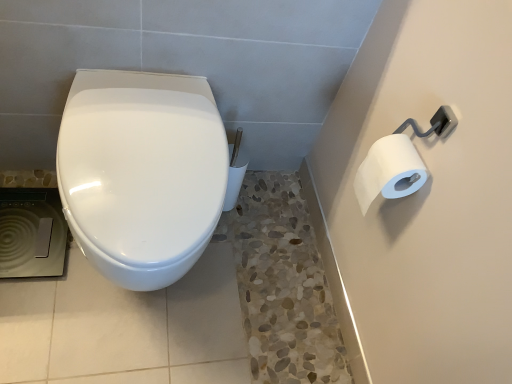
Question: Is white matte toilet paper at upper right to the left or to the right of glossy ceramic toilet at center in the image?

Choices:
 (A) left
 (B) right

Answer: (B)

Question: From the image's perspective, is white matte toilet paper at upper right above or below glossy ceramic toilet at center?

Choices:
 (A) below
 (B) above

Answer: (B)

Question: Relative to glossy ceramic toilet at center, is white matte toilet paper at upper right in front or behind?

Choices:
 (A) front
 (B) behind

Answer: (B)

Question: From the image's perspective, is glossy ceramic toilet at center positioned above or below white matte toilet paper at upper right?

Choices:
 (A) above
 (B) below

Answer: (B)

Question: Is glossy ceramic toilet at center in front of or behind white matte toilet paper at upper right in the image?

Choices:
 (A) front
 (B) behind

Answer: (A)

Question: In terms of width, does glossy ceramic toilet at center look wider or thinner when compared to white matte toilet paper at upper right?

Choices:
 (A) wide
 (B) thin

Answer: (A)

Question: From a real-world perspective, relative to white matte toilet paper at upper right, is glossy ceramic toilet at center vertically above or below?

Choices:
 (A) above
 (B) below

Answer: (B)